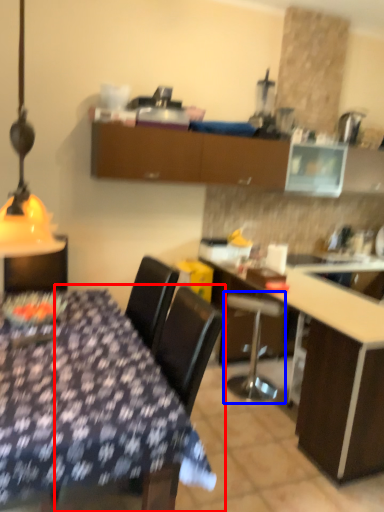
Question: Which point is further to the camera, chair (highlighted by a red box) or bar stool (highlighted by a blue box)?

Choices:
 (A) chair
 (B) bar stool

Answer: (B)